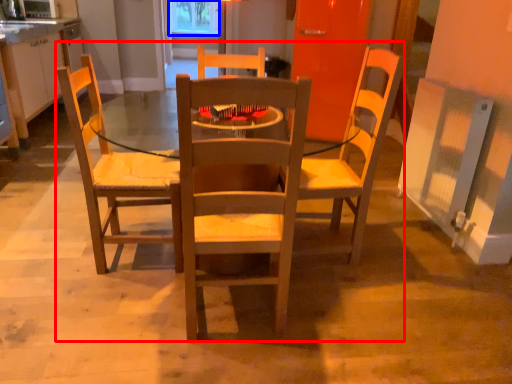
Question: Which point is further to the camera, trio (highlighted by a red box) or window screen (highlighted by a blue box)?

Choices:
 (A) trio
 (B) window screen

Answer: (B)